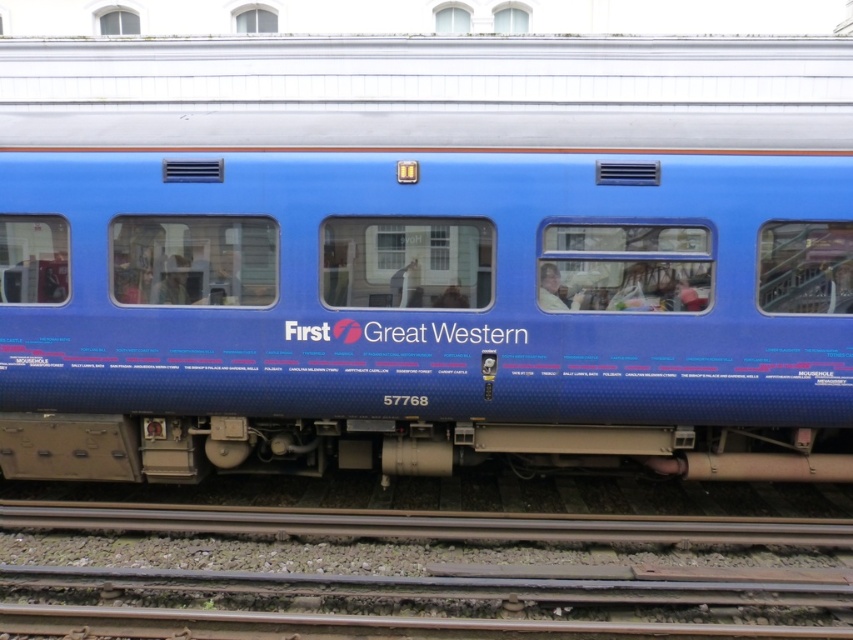
Question: Does blue glossy train car at center appear under smooth metal track at bottom?

Choices:
 (A) no
 (B) yes

Answer: (A)

Question: Can you confirm if blue glossy train car at center is positioned above smooth metal track at bottom?

Choices:
 (A) no
 (B) yes

Answer: (B)

Question: Can you confirm if blue glossy train car at center is positioned to the right of smooth metal track at bottom?

Choices:
 (A) yes
 (B) no

Answer: (B)